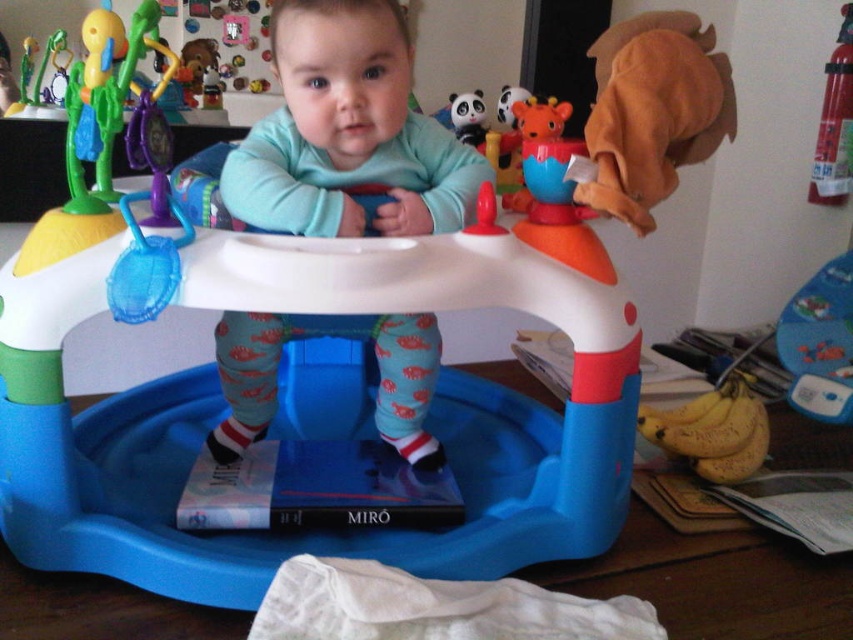
Question: Which is nearer to the blue soft walker at center?

Choices:
 (A) blue plastic walker at center
 (B) yellow matte bananas at lower right

Answer: (A)

Question: Is blue soft walker at center smaller than yellow matte bananas at lower right?

Choices:
 (A) yes
 (B) no

Answer: (B)

Question: In this image, where is blue plastic walker at center located relative to blue soft walker at center?

Choices:
 (A) above
 (B) below

Answer: (B)

Question: Which point is closer to the camera taking this photo?

Choices:
 (A) (695, 461)
 (B) (299, 138)
 (C) (404, 548)

Answer: (C)

Question: Does blue plastic walker at center have a greater width compared to yellow matte bananas at lower right?

Choices:
 (A) yes
 (B) no

Answer: (A)

Question: Based on their relative distances, which object is nearer to the blue soft walker at center?

Choices:
 (A) blue plastic walker at center
 (B) yellow matte bananas at lower right

Answer: (A)